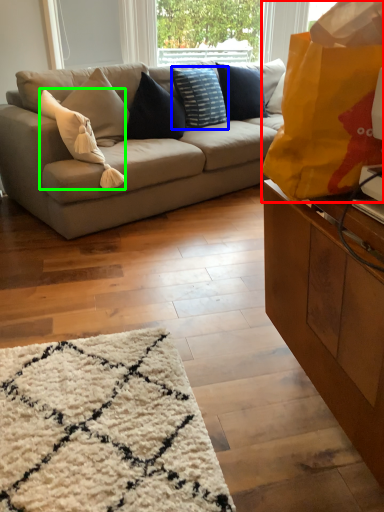
Question: Which object is positioned closest to bag (highlighted by a red box)? Select from pillow (highlighted by a blue box) and pillow (highlighted by a green box).

Choices:
 (A) pillow
 (B) pillow

Answer: (B)